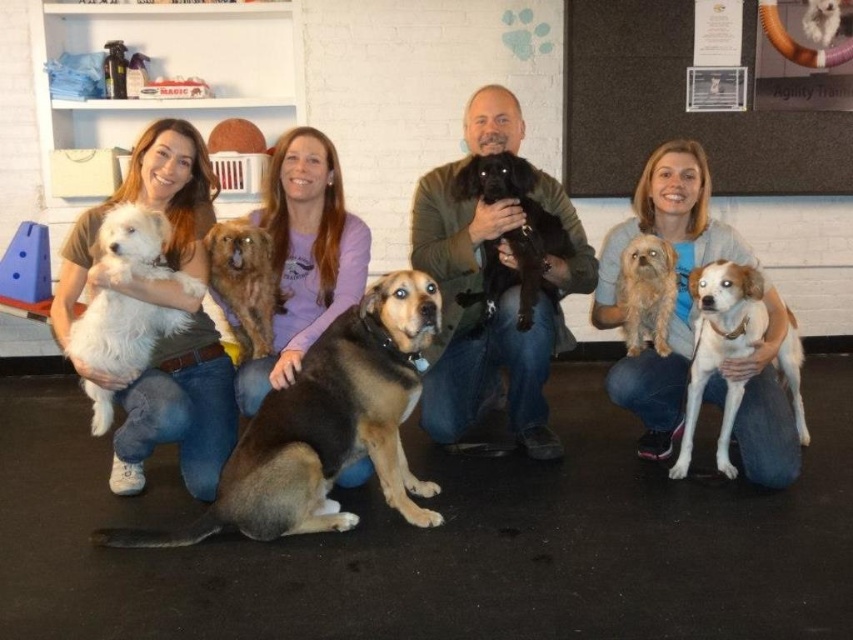
You are a photographer who needs to arrange the white fur dog at left and the shaggy brown dog at center for a group photo. Which dog should stand in the back row to ensure both are fully visible?

The white fur dog at left should stand in the back row because it is much taller than the shaggy brown dog at center, allowing the shorter dog to be visible in front.

You are a photographer trying to capture a clear shot of both the light blue shirt at center and the fuzzy brown dog at center. Since you want both subjects to be in focus, you need to adjust your camera settings. Based on their positions, which subject should you focus on first to ensure both are sharp?

The light blue shirt at center is located below the fuzzy brown dog at center. To ensure both are in focus, you should focus on the fuzzy brown dog at center first because it is farther away from the camera. This technique, known as the hyperfocal distance, prioritizes focusing on the farther subject to maximize depth of field and keep both in focus.

You are a photographer trying to take a group photo of the smooth purple shirt at center and the fuzzy brown dog at center. Since you want to ensure both are visible, which one should you focus on first based on their position?

The smooth purple shirt at center is positioned on the left side of fuzzy brown dog at center, so you should focus on the smooth purple shirt at center first to ensure both are visible.